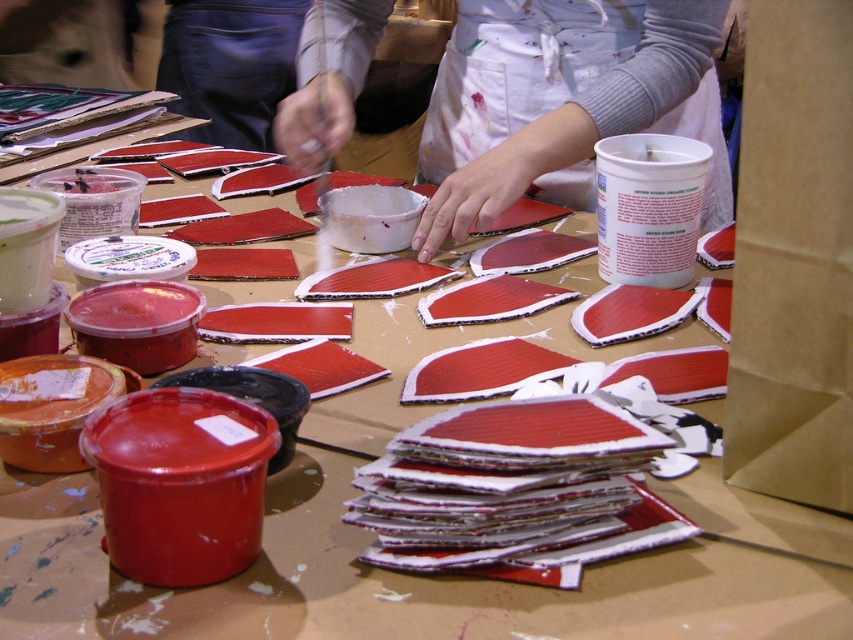
Question: Which of the following is the closest to the observer?

Choices:
 (A) (469, 188)
 (B) (845, 67)

Answer: (B)

Question: Which object is farther from the camera taking this photo?

Choices:
 (A) brown paper bag at right
 (B) white apron at center

Answer: (B)

Question: Is the position of brown paper bag at right more distant than that of white apron at center?

Choices:
 (A) no
 (B) yes

Answer: (A)

Question: Can you confirm if brown paper bag at right is positioned below white apron at center?

Choices:
 (A) no
 (B) yes

Answer: (B)

Question: Does brown paper bag at right have a greater width compared to white apron at center?

Choices:
 (A) yes
 (B) no

Answer: (B)